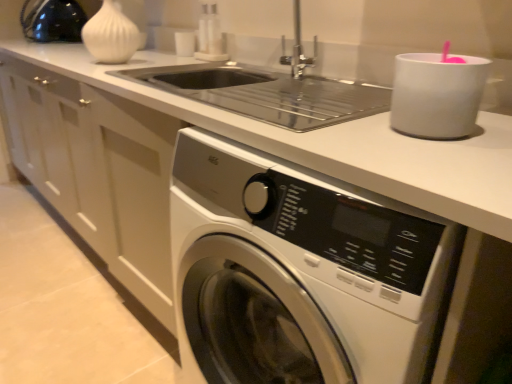
Question: From the image's perspective, is white matte vase at upper left located beneath white matte cup at upper right, the 2th appliance from the top?

Choices:
 (A) no
 (B) yes

Answer: (A)

Question: Does white matte vase at upper left have a smaller size compared to white matte cup at upper right, which is the 2th appliance from left to right?

Choices:
 (A) yes
 (B) no

Answer: (B)

Question: Does white matte vase at upper left have a lesser height compared to white matte cup at upper right, the 2th appliance from the top?

Choices:
 (A) yes
 (B) no

Answer: (B)

Question: Is white matte cup at upper right, the first appliance from the front, surrounded by white matte vase at upper left?

Choices:
 (A) no
 (B) yes

Answer: (A)

Question: Is white matte vase at upper left looking in the opposite direction of white matte cup at upper right, the first appliance from the front?

Choices:
 (A) no
 (B) yes

Answer: (A)

Question: Is white matte vase at upper left taller than white matte cup at upper right, the first appliance in the bottom-to-top sequence?

Choices:
 (A) no
 (B) yes

Answer: (B)

Question: Can you confirm if white glossy washing machine at lower center is shorter than matte black kettle at upper left, the second appliance from the right?

Choices:
 (A) no
 (B) yes

Answer: (A)

Question: From a real-world perspective, is white glossy washing machine at lower center on matte black kettle at upper left, acting as the 2th appliance starting from the bottom?

Choices:
 (A) yes
 (B) no

Answer: (B)

Question: Can we say white glossy washing machine at lower center lies outside matte black kettle at upper left, the second appliance from the right?

Choices:
 (A) yes
 (B) no

Answer: (A)

Question: Considering the relative sizes of white glossy washing machine at lower center and matte black kettle at upper left, which appears as the first appliance when viewed from the top, in the image provided, is white glossy washing machine at lower center taller than matte black kettle at upper left, which appears as the first appliance when viewed from the top,?

Choices:
 (A) no
 (B) yes

Answer: (B)

Question: From a real-world perspective, is white glossy washing machine at lower center physically below matte black kettle at upper left, which is the second appliance from front to back?

Choices:
 (A) yes
 (B) no

Answer: (A)

Question: Is white glossy washing machine at lower center at the right side of matte black kettle at upper left, which appears as the first appliance when viewed from the top?

Choices:
 (A) no
 (B) yes

Answer: (B)

Question: From the image's perspective, does white matte cup at upper right, positioned as the second appliance in back-to-front order, appear lower than white matte vase at upper left?

Choices:
 (A) no
 (B) yes

Answer: (B)